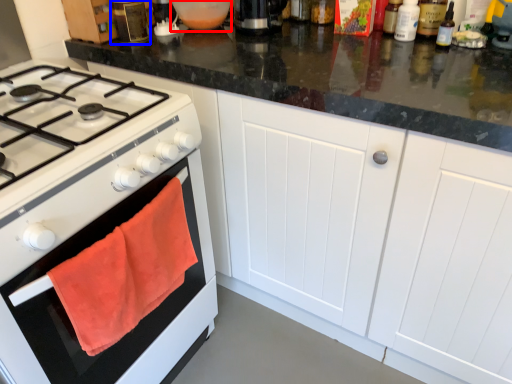
Question: Which point is closer to the camera, appliance (highlighted by a red box) or kitchen appliance (highlighted by a blue box)?

Choices:
 (A) appliance
 (B) kitchen appliance

Answer: (B)